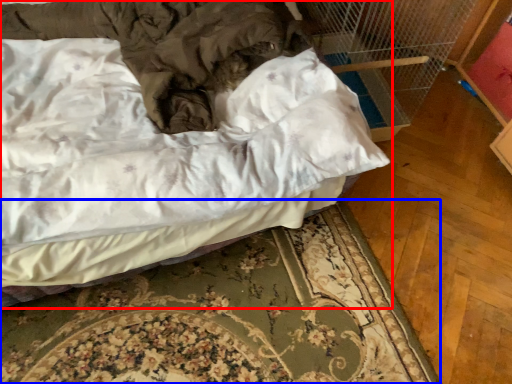
Question: Among these objects, which one is nearest to the camera, bed (highlighted by a red box) or bed frame (highlighted by a blue box)?

Choices:
 (A) bed
 (B) bed frame

Answer: (A)